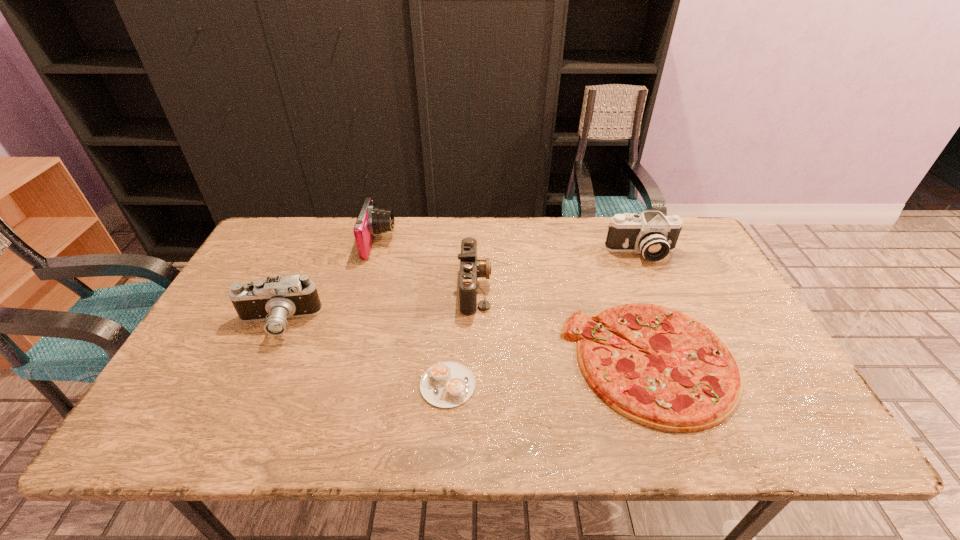
In order to click on vacant position located on the left of the pizza in this screenshot , I will do `click(426, 361)`.

This screenshot has width=960, height=540. In order to click on vacant area situated 0.300m on the back of the shortest object in this screenshot , I will do `click(455, 281)`.

Where is `object that is positioned at the near edge`? This screenshot has width=960, height=540. object that is positioned at the near edge is located at coordinates (687, 379).

At what (x,y) coordinates should I click in order to perform the action: click on object that is at the left edge. Please return your answer as a coordinate pair (x, y). Image resolution: width=960 pixels, height=540 pixels. Looking at the image, I should click on point(274,300).

Where is `camera positioned at the right edge`? This screenshot has height=540, width=960. camera positioned at the right edge is located at coordinates (652, 234).

Find the location of a particular element. pizza positioned at the right edge is located at coordinates (687, 379).

The image size is (960, 540). I want to click on object located at the far right corner, so click(x=652, y=234).

Identify the location of object located at the near right corner. (687, 379).

In the image, there is a desktop. Identify the location of vacant space at the far edge. click(544, 235).

Locate an element on the screen. free region at the near edge is located at coordinates (314, 434).